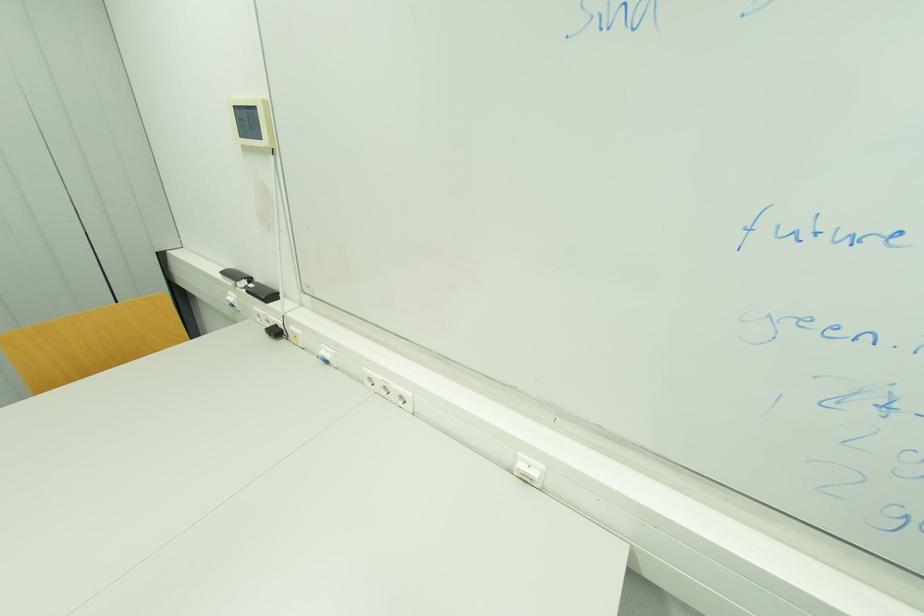
Find the location of a particular element. The width and height of the screenshot is (924, 616). blue network socket is located at coordinates (251, 122).